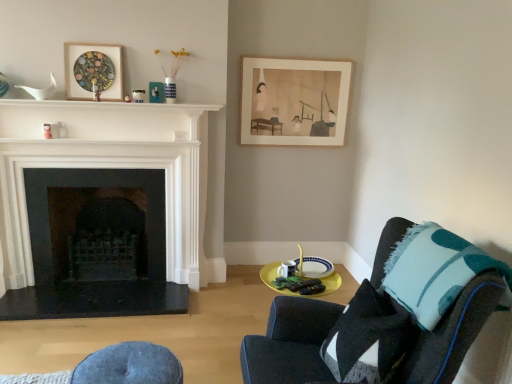
Measure the distance between matte paper picture frame at upper center, the 3th picture frame when ordered from front to back, and camera.

The distance of matte paper picture frame at upper center, the 3th picture frame when ordered from front to back, from camera is 3.36 meters.

What is the approximate width of matte black picture frame at upper center, acting as the 2th picture frame starting from the back?

matte black picture frame at upper center, acting as the 2th picture frame starting from the back, is 4.08 centimeters in width.

Find the location of a particular element. black stone fireplace at left, marked as the 2th fireplace in a front-to-back arrangement is located at coordinates (93, 186).

The height and width of the screenshot is (384, 512). I want to click on teal felt throw pillow at right, so click(436, 272).

Locate an element on the screen. white ceramic plate at lower center is located at coordinates (316, 267).

Considering the sizes of objects denim cushion at lower center and matte paper picture frame at upper center, placed as the third picture frame when sorted from left to right, in the image provided, who is bigger, denim cushion at lower center or matte paper picture frame at upper center, placed as the third picture frame when sorted from left to right,?

Bigger between the two is denim cushion at lower center.

Can you tell me how much denim cushion at lower center and matte paper picture frame at upper center, the 3th picture frame when ordered from front to back, differ in facing direction?

90.9 degrees.

From the image's perspective, which is below, denim cushion at lower center or matte paper picture frame at upper center, arranged as the first picture frame when viewed from the back?

denim cushion at lower center.

Relative to matte paper picture frame at upper center, placed as the third picture frame when sorted from left to right, is denim cushion at lower center in front or behind?

denim cushion at lower center is in front of matte paper picture frame at upper center, placed as the third picture frame when sorted from left to right.

Which is more to the left, matte paper picture frame at upper center, the 1th picture frame from the right, or white ceramic plate at lower center?

matte paper picture frame at upper center, the 1th picture frame from the right, is more to the left.

Is matte paper picture frame at upper center, arranged as the first picture frame when viewed from the back, wider or thinner than white ceramic plate at lower center?

In the image, matte paper picture frame at upper center, arranged as the first picture frame when viewed from the back, appears to be more narrow than white ceramic plate at lower center.

In the scene shown: From a real-world perspective, is matte paper picture frame at upper center, placed as the third picture frame when sorted from left to right, physically located above or below white ceramic plate at lower center?

In terms of real-world spatial position, matte paper picture frame at upper center, placed as the third picture frame when sorted from left to right, is above white ceramic plate at lower center.

This screenshot has width=512, height=384. Identify the location of plate below the matte paper picture frame at upper center, the 1th picture frame from the right (from the image's perspective). (316, 267).

Does dark blue fabric chair at lower right have a smaller size compared to white ceramic plate at lower center?

No, dark blue fabric chair at lower right is not smaller than white ceramic plate at lower center.

Would you consider dark blue fabric chair at lower right to be distant from white ceramic plate at lower center?

Actually, dark blue fabric chair at lower right and white ceramic plate at lower center are a little close together.

The image size is (512, 384). In order to click on chair to the right of white ceramic plate at lower center in this screenshot , I will do click(x=291, y=343).

Can you tell me how much dark blue fabric chair at lower right and white ceramic plate at lower center differ in facing direction?

They differ by 0.00339 degrees in their facing directions.

Can you confirm if white ceramic plate at lower center is thinner than white glossy fireplace at left, the second fireplace from the back?

In fact, white ceramic plate at lower center might be wider than white glossy fireplace at left, the second fireplace from the back.

Looking at this image, from a real-world perspective, is white ceramic plate at lower center on top of white glossy fireplace at left, the second fireplace from the back?

No, from a real-world perspective, white ceramic plate at lower center is not over white glossy fireplace at left, the second fireplace from the back

Is white ceramic plate at lower center positioned beyond the bounds of white glossy fireplace at left, the first fireplace positioned from the front?

Yes, white ceramic plate at lower center is not within white glossy fireplace at left, the first fireplace positioned from the front.

From a real-world perspective, is matte black picture frame at upper center, which is the second picture frame from left to right, positioned under white ceramic plate at lower center based on gravity?

Incorrect, from a real-world perspective, matte black picture frame at upper center, which is the second picture frame from left to right, is higher than white ceramic plate at lower center.

Considering the relative positions of matte black picture frame at upper center, acting as the 2th picture frame starting from the back, and white ceramic plate at lower center in the image provided, is matte black picture frame at upper center, acting as the 2th picture frame starting from the back, to the right of white ceramic plate at lower center from the viewer's perspective?

No, matte black picture frame at upper center, acting as the 2th picture frame starting from the back, is not to the right of white ceramic plate at lower center.

Would you say matte black picture frame at upper center, arranged as the second picture frame when viewed from the front, contains white ceramic plate at lower center?

No, white ceramic plate at lower center is not a part of matte black picture frame at upper center, arranged as the second picture frame when viewed from the front.

Is the depth of white ceramic plate at lower center less than that of matte paper picture frame at upper center, arranged as the first picture frame when viewed from the back?

Yes, it is.

In terms of height, does white ceramic plate at lower center look taller or shorter compared to matte paper picture frame at upper center, the 3th picture frame when ordered from front to back?

Clearly, white ceramic plate at lower center is shorter compared to matte paper picture frame at upper center, the 3th picture frame when ordered from front to back.

Identify the location of plate on the right of matte paper picture frame at upper center, arranged as the first picture frame when viewed from the back. This screenshot has height=384, width=512. (316, 267).

Which of these two, white ceramic plate at lower center or matte paper picture frame at upper center, the 1th picture frame from the right, is thinner?

Thinner between the two is matte paper picture frame at upper center, the 1th picture frame from the right.

Does matte paper picture frame at upper center, placed as the third picture frame when sorted from left to right, have a greater height compared to black stone fireplace at left, marked as the 2th fireplace in a front-to-back arrangement?

In fact, matte paper picture frame at upper center, placed as the third picture frame when sorted from left to right, may be shorter than black stone fireplace at left, marked as the 2th fireplace in a front-to-back arrangement.

How many degrees apart are the facing directions of matte paper picture frame at upper center, the 1th picture frame from the right, and black stone fireplace at left, marked as the 2th fireplace in a front-to-back arrangement?

There is a 0.819-degree angle between the facing directions of matte paper picture frame at upper center, the 1th picture frame from the right, and black stone fireplace at left, marked as the 2th fireplace in a front-to-back arrangement.

Is matte paper picture frame at upper center, arranged as the first picture frame when viewed from the back, outside of black stone fireplace at left, marked as the 2th fireplace in a front-to-back arrangement?

matte paper picture frame at upper center, arranged as the first picture frame when viewed from the back, is positioned outside black stone fireplace at left, marked as the 2th fireplace in a front-to-back arrangement.

Find the location of a particular element. the 1st fireplace in front of the matte paper picture frame at upper center, the 1th picture frame from the right, counting from the anchor's position is located at coordinates (93, 186).

Locate an element on the screen. This screenshot has height=384, width=512. swivel chair located underneath the matte paper picture frame at upper center, placed as the third picture frame when sorted from left to right (from a real-world perspective) is located at coordinates (115, 367).

Locate an element on the screen. This screenshot has width=512, height=384. plate lying in front of the matte paper picture frame at upper center, placed as the third picture frame when sorted from left to right is located at coordinates (316, 267).

Which object lies nearer to the anchor point teal felt throw pillow at right, matte paper picture frame at upper center, the 1th picture frame from the right, or denim cushion at lower center?

denim cushion at lower center.

Estimate the real-world distances between objects in this image. Which object is further from black stone fireplace at left, which ranks as the first fireplace in back-to-front order, white glossy fireplace at left, the first fireplace positioned from the front, or wooden stained picture frame at upper left, arranged as the 3th picture frame when viewed from the back?

wooden stained picture frame at upper left, arranged as the 3th picture frame when viewed from the back, is further to black stone fireplace at left, which ranks as the first fireplace in back-to-front order.

From the image, which object appears to be farther from denim cushion at lower center, matte paper picture frame at upper center, placed as the third picture frame when sorted from left to right, or white glossy mantle at upper center?

matte paper picture frame at upper center, placed as the third picture frame when sorted from left to right, lies further to denim cushion at lower center than the other object.

Looking at the image, which one is located further to denim cushion at lower center, white glossy fireplace at left, the second fireplace from the back, or dark blue fabric chair at lower right?

Based on the image, white glossy fireplace at left, the second fireplace from the back, appears to be further to denim cushion at lower center.

When comparing their distances from matte paper picture frame at upper center, the 3th picture frame when ordered from front to back, does white glossy mantle at upper center or dark blue fabric chair at lower right seem closer?

Among the two, white glossy mantle at upper center is located nearer to matte paper picture frame at upper center, the 3th picture frame when ordered from front to back.

Based on their spatial positions, is denim cushion at lower center or matte paper picture frame at upper center, arranged as the first picture frame when viewed from the back, further from teal felt throw pillow at right?

Based on the image, matte paper picture frame at upper center, arranged as the first picture frame when viewed from the back, appears to be further to teal felt throw pillow at right.

Considering their positions, is black stone fireplace at left, marked as the 2th fireplace in a front-to-back arrangement, positioned further to matte black picture frame at upper center, arranged as the second picture frame when viewed from the front, than white glossy fireplace at left, the second fireplace from the back?

white glossy fireplace at left, the second fireplace from the back, lies further to matte black picture frame at upper center, arranged as the second picture frame when viewed from the front, than the other object.

When comparing their distances from wooden stained picture frame at upper left, which ranks as the 1th picture frame in left-to-right order, does white ceramic plate at lower center or matte paper picture frame at upper center, the 1th picture frame from the right, seem further?

white ceramic plate at lower center is positioned further to the anchor wooden stained picture frame at upper left, which ranks as the 1th picture frame in left-to-right order.

At what (x,y) coordinates should I click in order to perform the action: click on swivel chair located between black stone fireplace at left, which ranks as the first fireplace in back-to-front order, and white ceramic plate at lower center in the left-right direction. Please return your answer as a coordinate pair (x, y). The width and height of the screenshot is (512, 384). Looking at the image, I should click on coord(115,367).

Locate an element on the screen. plate situated between denim cushion at lower center and teal felt throw pillow at right from left to right is located at coordinates (316, 267).

The image size is (512, 384). In order to click on chair between wooden stained picture frame at upper left, arranged as the 3th picture frame when viewed from the back, and denim cushion at lower center in the up-down direction in this screenshot , I will do `click(291, 343)`.

The width and height of the screenshot is (512, 384). I want to click on picture frame that lies between matte paper picture frame at upper center, the 3th picture frame when ordered from front to back, and white ceramic plate at lower center from top to bottom, so click(x=156, y=92).